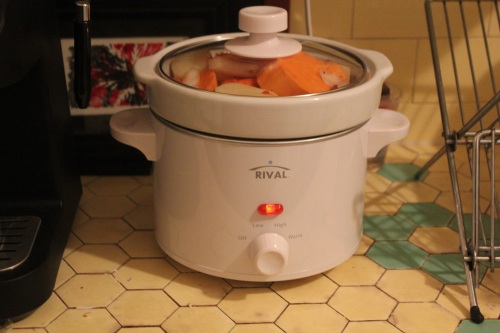
At what (x,y) coordinates should I click in order to perform the action: click on handle. Please return your answer as a coordinate pair (x, y). The height and width of the screenshot is (333, 500). Looking at the image, I should click on (265, 17).